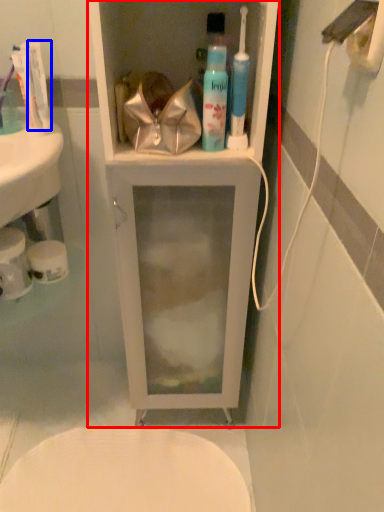
Question: Which of the following is the farthest to the observer, bathroom cabinet (highlighted by a red box) or toothpaste (highlighted by a blue box)?

Choices:
 (A) bathroom cabinet
 (B) toothpaste

Answer: (B)